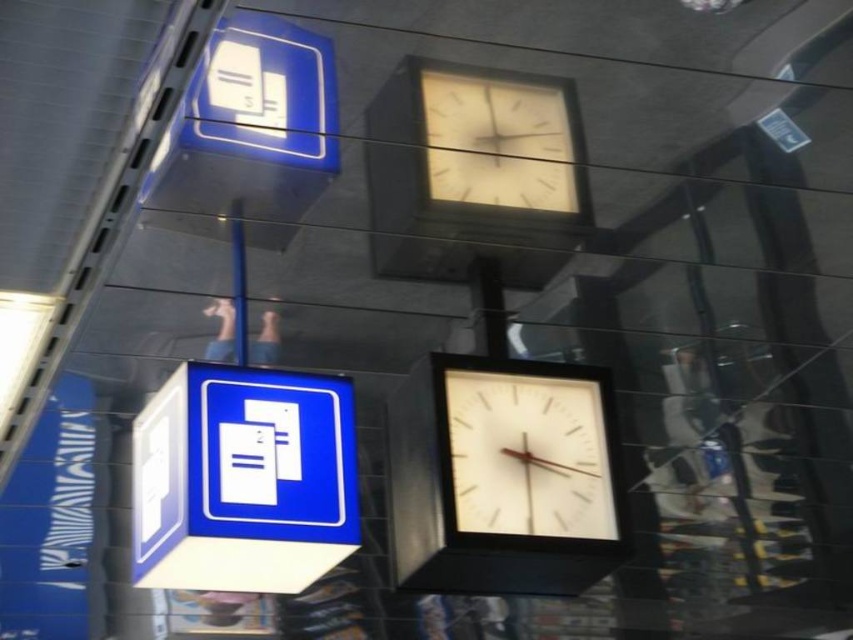
Which of these two, blue glossy sign at upper left or white matte clock at upper center, stands shorter?

white matte clock at upper center is shorter.

Which of these two, blue glossy sign at upper left or white matte clock at upper center, stands taller?

With more height is blue glossy sign at upper left.

Who is more distant from viewer, (300, 474) or (531, 100)?

Positioned behind is point (300, 474).

Locate an element on the screen. This screenshot has height=640, width=853. blue glossy sign at upper left is located at coordinates (242, 480).

Does white matte clock at upper center have a lesser height compared to metallic pole at center?

Yes.

Between white matte clock at upper center and metallic pole at center, which one has less height?

With less height is white matte clock at upper center.

Which is in front, point (460, 196) or point (233, 221)?

Point (460, 196)

Image resolution: width=853 pixels, height=640 pixels. Identify the location of white matte clock at upper center. (498, 140).

Is point (508, 401) less distant than point (477, 140)?

No, it is not.

Can you confirm if white glossy clock at center is shorter than white matte clock at upper center?

Incorrect, white glossy clock at center's height does not fall short of white matte clock at upper center's.

Between point (581, 452) and point (469, 124), which one is positioned in front?

Point (469, 124) is more forward.

At what (x,y) coordinates should I click in order to perform the action: click on white glossy clock at center. Please return your answer as a coordinate pair (x, y). Looking at the image, I should click on (527, 454).